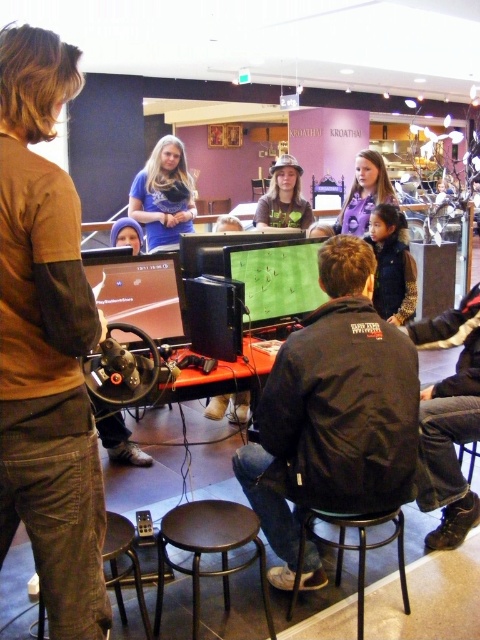
You are a photographer positioned at the back of the room. You want to take a photo of both the black matte jacket at center and the blue cotton shirt at center. Which one will appear larger in your photo?

The black matte jacket at center will appear larger in the photo because it is closer to the viewer than the blue cotton shirt at center.

You are a visitor at the event and want to sit down on the dark brown wood stool at lower center. However, there is a blue fabric hat at center on it. Can you sit there without moving the hat?

The dark brown wood stool at lower center is taller than the blue fabric hat at center, so you can sit on the stool without moving the hat as the hat might be placed on a lower part or you can adjust your position accordingly.